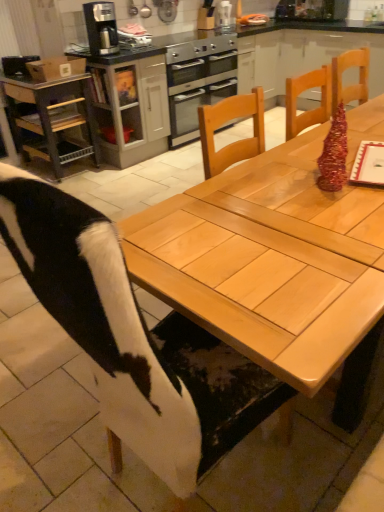
Question: Is stainless steel oven at center smaller than natural wood table at center?

Choices:
 (A) yes
 (B) no

Answer: (A)

Question: Is stainless steel oven at center at the right side of natural wood table at center?

Choices:
 (A) no
 (B) yes

Answer: (A)

Question: Is stainless steel oven at center positioned behind natural wood table at center?

Choices:
 (A) no
 (B) yes

Answer: (B)

Question: Can you confirm if stainless steel oven at center is thinner than natural wood table at center?

Choices:
 (A) yes
 (B) no

Answer: (A)

Question: From a real-world perspective, is stainless steel oven at center located beneath natural wood table at center?

Choices:
 (A) no
 (B) yes

Answer: (A)

Question: Is there a large distance between stainless steel oven at center and natural wood table at center?

Choices:
 (A) no
 (B) yes

Answer: (B)

Question: Considering the relative positions of metallic gray cart at left and natural wood table at center in the image provided, is metallic gray cart at left behind natural wood table at center?

Choices:
 (A) yes
 (B) no

Answer: (A)

Question: Can you confirm if metallic gray cart at left is thinner than natural wood table at center?

Choices:
 (A) yes
 (B) no

Answer: (A)

Question: Does metallic gray cart at left turn towards natural wood table at center?

Choices:
 (A) no
 (B) yes

Answer: (B)

Question: From the image's perspective, is metallic gray cart at left beneath natural wood table at center?

Choices:
 (A) yes
 (B) no

Answer: (B)

Question: Is metallic gray cart at left far from natural wood table at center?

Choices:
 (A) no
 (B) yes

Answer: (B)

Question: Is metallic gray cart at left closer to camera compared to natural wood table at center?

Choices:
 (A) yes
 (B) no

Answer: (B)

Question: Considering the relative sizes of stainless steel oven at center and metallic gray cart at left in the image provided, is stainless steel oven at center shorter than metallic gray cart at left?

Choices:
 (A) yes
 (B) no

Answer: (A)